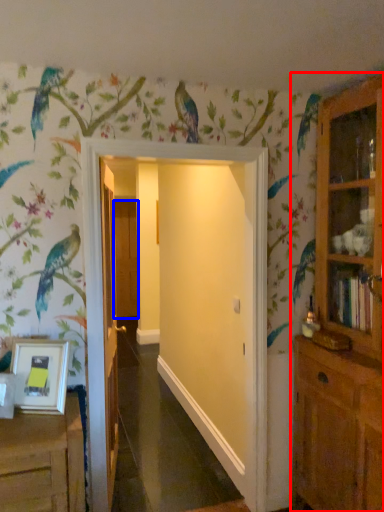
Question: Among these objects, which one is nearest to the camera, cupboard (highlighted by a red box) or door (highlighted by a blue box)?

Choices:
 (A) cupboard
 (B) door

Answer: (A)